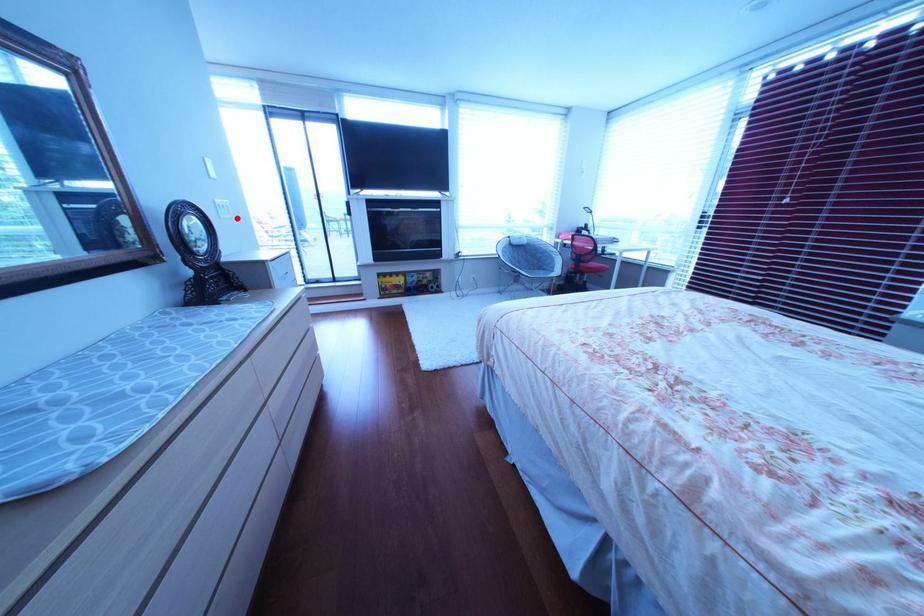
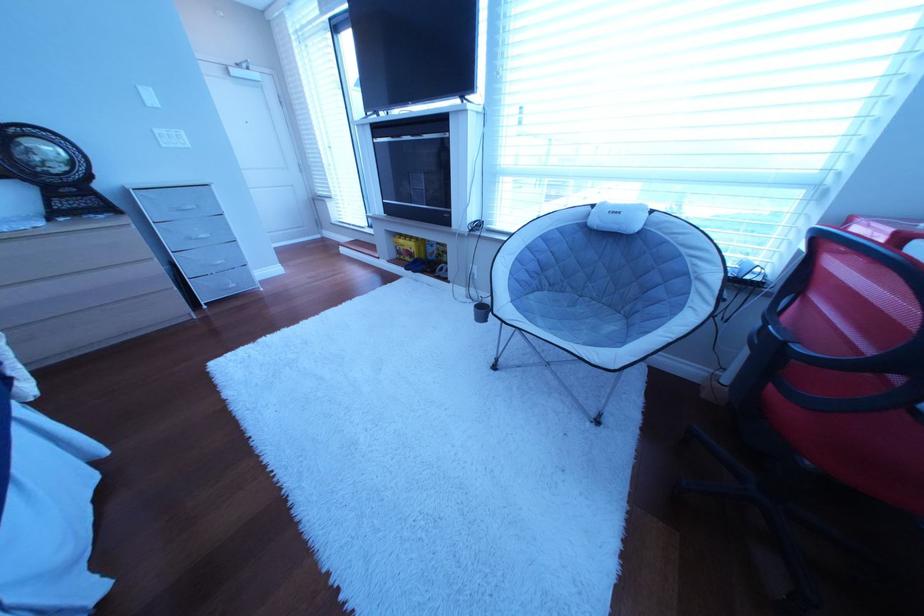
Question: I am providing you with two images of the same scene from different viewpoints. Given a red point in image1, look at the same physical point in image2. Is it:

Choices:
 (A) Closer to the viewpoint
 (B) Farther from the viewpoint

Answer: (B)